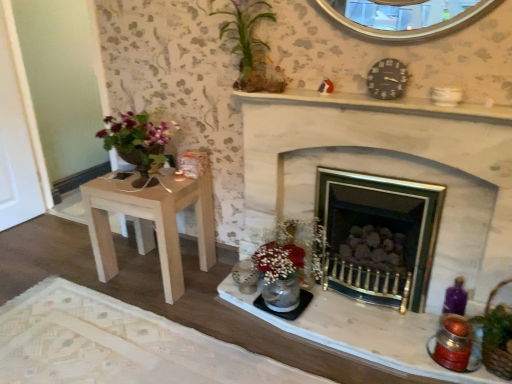
Question: Can you confirm if brown woven basket at lower right is wider than green leafy plant at upper center?

Choices:
 (A) yes
 (B) no

Answer: (B)

Question: Considering the relative sizes of brown woven basket at lower right and green leafy plant at upper center in the image provided, is brown woven basket at lower right thinner than green leafy plant at upper center?

Choices:
 (A) no
 (B) yes

Answer: (B)

Question: Is the position of brown woven basket at lower right less distant than that of green leafy plant at upper center?

Choices:
 (A) yes
 (B) no

Answer: (A)

Question: From a real-world perspective, is brown woven basket at lower right positioned over green leafy plant at upper center based on gravity?

Choices:
 (A) yes
 (B) no

Answer: (B)

Question: Considering the relative positions of brown woven basket at lower right and green leafy plant at upper center in the image provided, is brown woven basket at lower right to the left of green leafy plant at upper center from the viewer's perspective?

Choices:
 (A) no
 (B) yes

Answer: (A)

Question: Can you see brown woven basket at lower right touching green leafy plant at upper center?

Choices:
 (A) yes
 (B) no

Answer: (B)

Question: Can you confirm if green leafy plant at upper center is positioned to the left of white marble mantel at upper center?

Choices:
 (A) yes
 (B) no

Answer: (A)

Question: Is green leafy plant at upper center shorter than white marble mantel at upper center?

Choices:
 (A) yes
 (B) no

Answer: (B)

Question: Is green leafy plant at upper center wider than white marble mantel at upper center?

Choices:
 (A) no
 (B) yes

Answer: (B)

Question: Is the position of green leafy plant at upper center less distant than that of white marble mantel at upper center?

Choices:
 (A) yes
 (B) no

Answer: (B)

Question: Is green leafy plant at upper center positioned behind white marble mantel at upper center?

Choices:
 (A) no
 (B) yes

Answer: (B)

Question: Considering the relative sizes of green leafy plant at upper center and white marble mantel at upper center in the image provided, is green leafy plant at upper center bigger than white marble mantel at upper center?

Choices:
 (A) no
 (B) yes

Answer: (B)

Question: Does black plastic clock at upper right turn towards white stone fireplace at center?

Choices:
 (A) yes
 (B) no

Answer: (B)